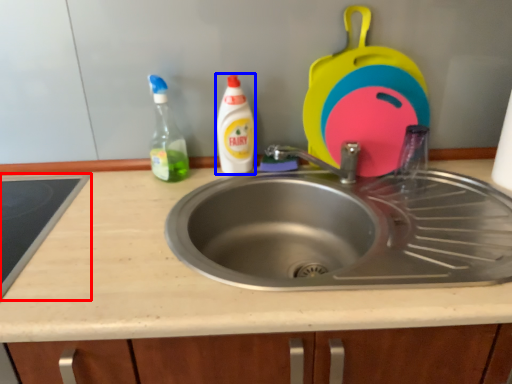
Question: Which point is closer to the camera, appliance (highlighted by a red box) or cleaning product (highlighted by a blue box)?

Choices:
 (A) appliance
 (B) cleaning product

Answer: (A)